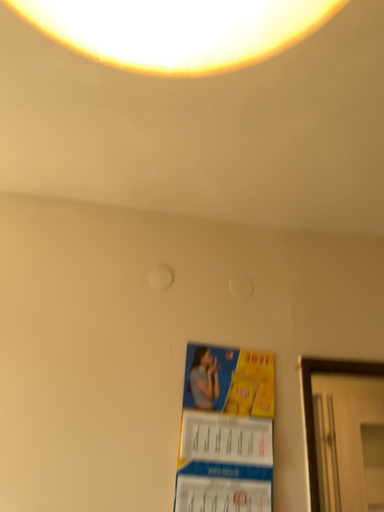
What is the approximate width of blue paper calendar at center?

blue paper calendar at center is 3.55 inches wide.

Locate an element on the screen. The height and width of the screenshot is (512, 384). blue paper calendar at center is located at coordinates (226, 431).

What do you see at coordinates (226, 431) in the screenshot? This screenshot has height=512, width=384. I see `blue paper calendar at center` at bounding box center [226, 431].

What is the approximate height of blue paper calendar at center?

20.77 inches.

You are a GUI agent. You are given a task and a screenshot of the screen. Output one action in this format:
    pyautogui.click(x=<x>, y=<y>)
    Task: Click on the blue paper calendar at center
    
    Given the screenshot: What is the action you would take?
    pyautogui.click(x=226, y=431)